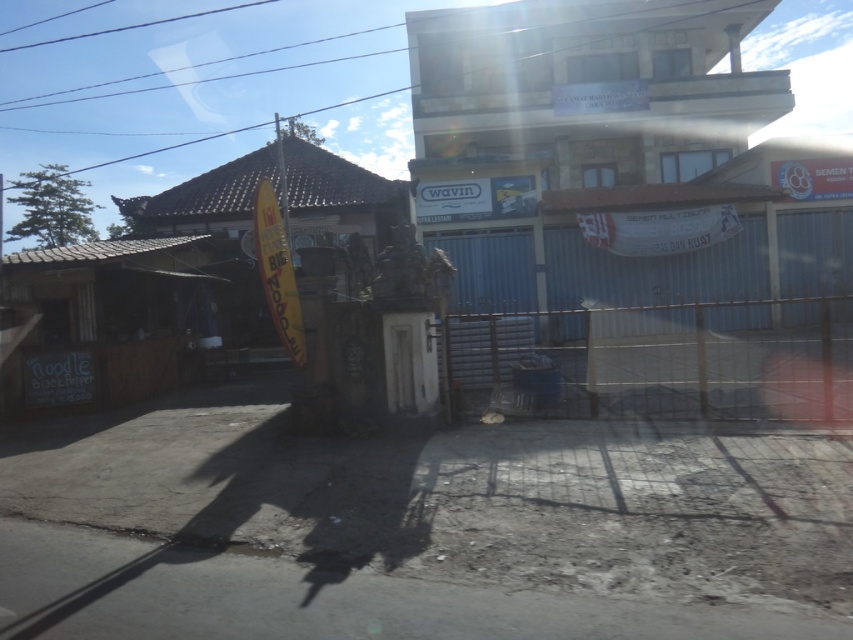
Consider the image. You are a delivery person needing to drive a 2.5 meter wide truck through either the dirt track at lower center or the metallic gate at center. Based on the scene, which path can accommodate your truck?

The metallic gate at center occupies more space than the dirt track at lower center, so the truck can pass through the metallic gate at center since it is wider than the dirt track.

You are a delivery driver with a motorcycle that requires a 3.5 meter clearance to pass through. You need to navigate from the dirt track at lower center to the metallic gate at center. Can your motorcycle safely pass through the space between them?

The dirt track at lower center is 4.22 meters from metallic gate at center, which is wider than the motorcycle requires, so yes, it can safely pass through.

You are a delivery person trying to reach the noodle BlueEggs shop located to the left of the metallic gate at center. Based on the scene, can you determine if the dirt track at lower center leads directly to the entrance of the noodle BlueEggs shop?

The dirt track at lower center is in front of the metallic gate at center, so it likely leads directly to the entrance of the noodle BlueEggs shop located to its left.